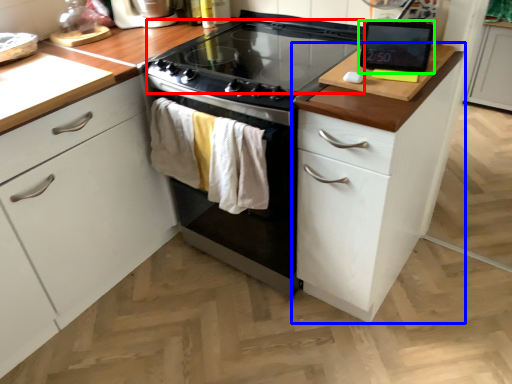
Question: Considering the real-world distances, which object is farthest from gas stove (highlighted by a red box)? cabinetry (highlighted by a blue box) or kitchen appliance (highlighted by a green box)?

Choices:
 (A) cabinetry
 (B) kitchen appliance

Answer: (A)